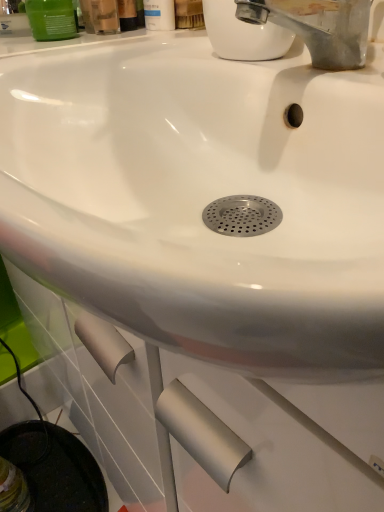
Question: In terms of width, does white matte bottle at upper center, the 1th mouthwash when ordered from right to left, look wider or thinner when compared to green matte container at upper left, the 1th mouthwash positioned from the left?

Choices:
 (A) thin
 (B) wide

Answer: (A)

Question: Considering the positions of white matte bottle at upper center, placed as the third mouthwash when sorted from left to right, and green matte container at upper left, marked as the 3th mouthwash in a right-to-left arrangement, in the image, is white matte bottle at upper center, placed as the third mouthwash when sorted from left to right, taller or shorter than green matte container at upper left, marked as the 3th mouthwash in a right-to-left arrangement,?

Choices:
 (A) tall
 (B) short

Answer: (A)

Question: Which object is the farthest from the matte plastic mouthwash at upper center, positioned as the second mouthwash in left-to-right order?

Choices:
 (A) green matte container at upper left, the 1th mouthwash positioned from the left
 (B) white matte bottle at upper center, placed as the third mouthwash when sorted from left to right

Answer: (B)

Question: Which object is positioned closest to the green matte container at upper left, the 1th mouthwash positioned from the left?

Choices:
 (A) matte plastic mouthwash at upper center, positioned as the second mouthwash in left-to-right order
 (B) white matte bottle at upper center, placed as the third mouthwash when sorted from left to right

Answer: (A)